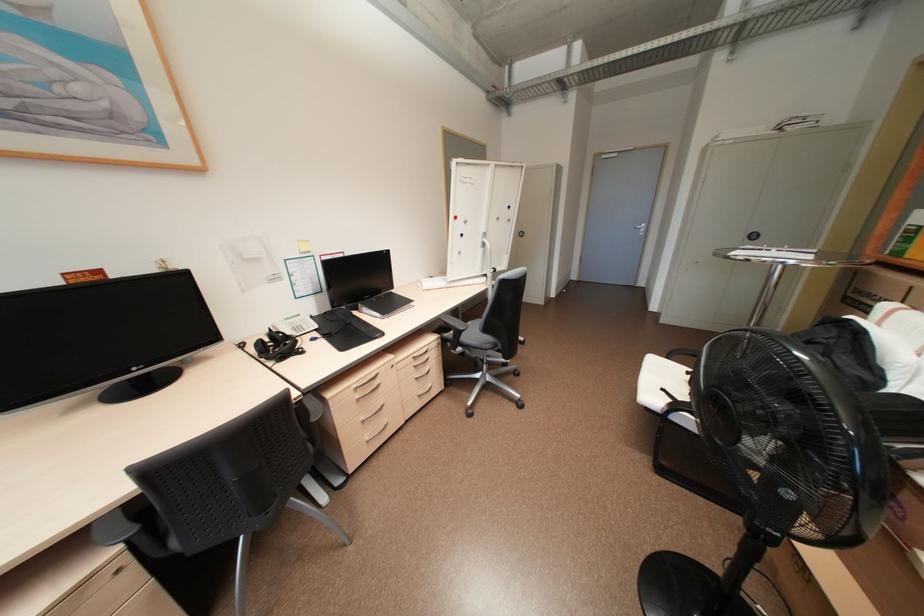
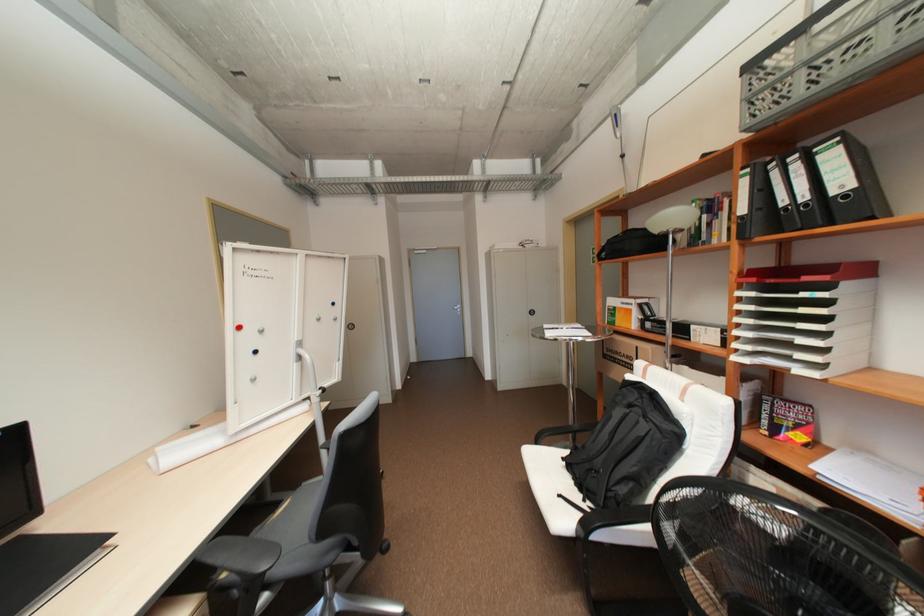
Question: Based on the continuous images, in which direction is the camera rotating? Reply with the corresponding letter.

Choices:
 (A) Left
 (B) Right
 (C) Up
 (D) Down

Answer: (B)